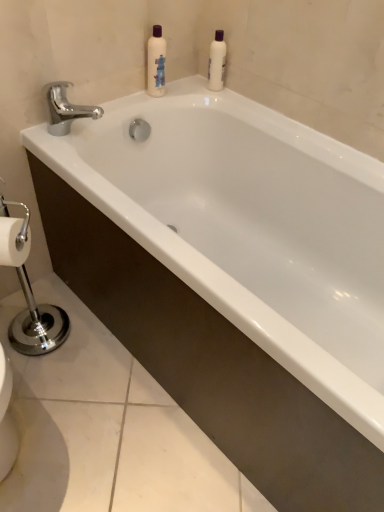
Find the location of `free space to the right of white glossy bottle at upper center, marked as the first cleaning product in a left-to-right arrangement`. free space to the right of white glossy bottle at upper center, marked as the first cleaning product in a left-to-right arrangement is located at coordinates (206, 92).